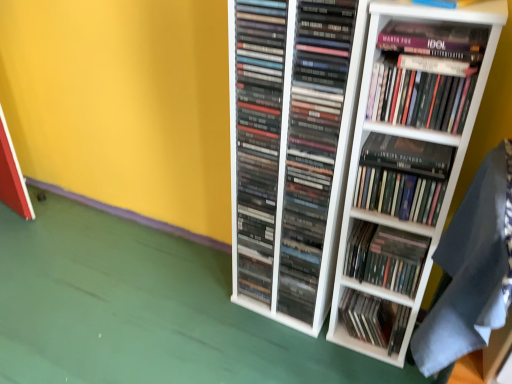
The width and height of the screenshot is (512, 384). I want to click on free space that is to the left of matte black book at center, which appears as the 7th book when viewed from the top, so click(310, 337).